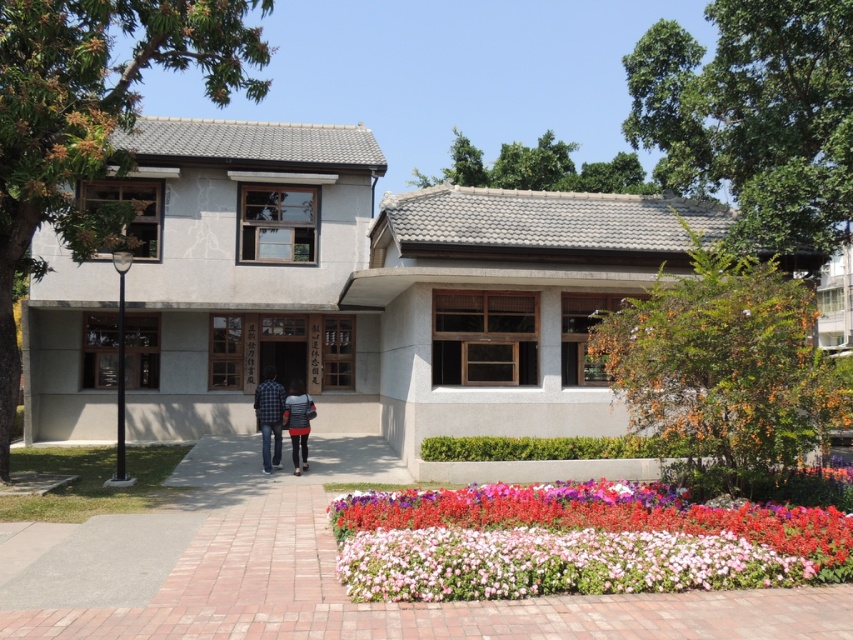
Question: Which point is farther to the camera?

Choices:
 (A) (268, 461)
 (B) (802, 563)

Answer: (A)

Question: Observing the image, what is the correct spatial positioning of matte concrete building at center in reference to multicolored floral carpet at lower center?

Choices:
 (A) left
 (B) right

Answer: (A)

Question: Is plaid shirt at center positioned at the back of striped fabric shirt at center?

Choices:
 (A) yes
 (B) no

Answer: (A)

Question: Which object is closer to the camera taking this photo?

Choices:
 (A) matte concrete building at center
 (B) plaid shirt at center
 (C) striped fabric shirt at center

Answer: (A)

Question: Which point is farther to the camera?

Choices:
 (A) (306, 417)
 (B) (271, 376)

Answer: (B)

Question: Can you confirm if multicolored floral carpet at lower center is positioned to the left of plaid shirt at center?

Choices:
 (A) no
 (B) yes

Answer: (A)